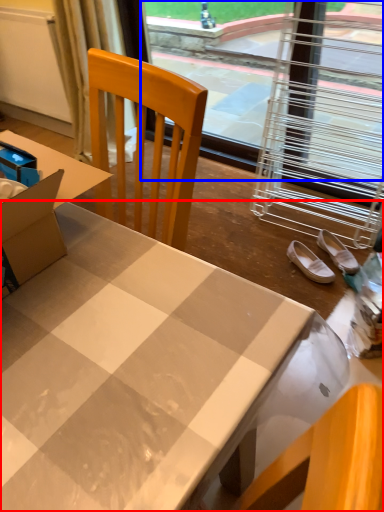
Question: Which object appears farthest to the camera in this image, desk (highlighted by a red box) or window screen (highlighted by a blue box)?

Choices:
 (A) desk
 (B) window screen

Answer: (B)